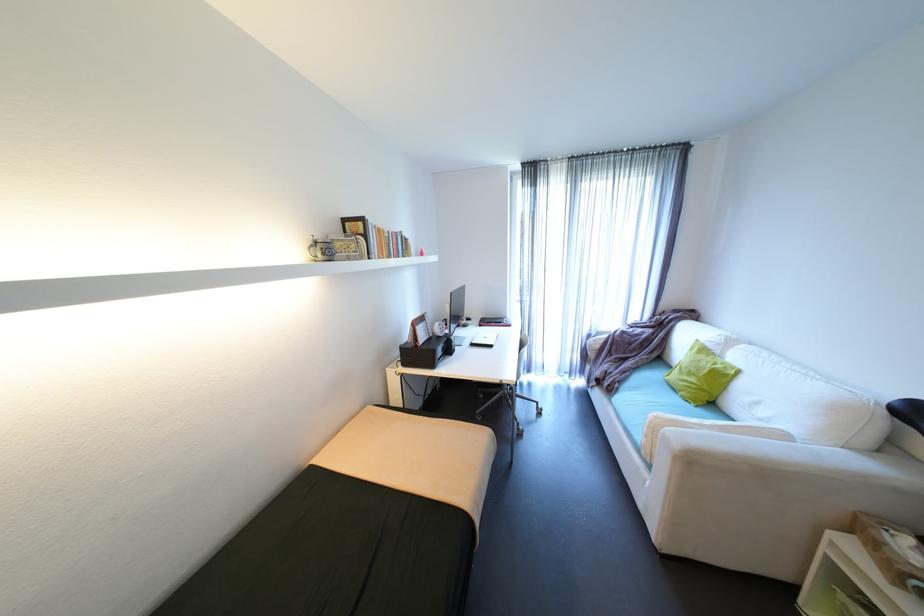
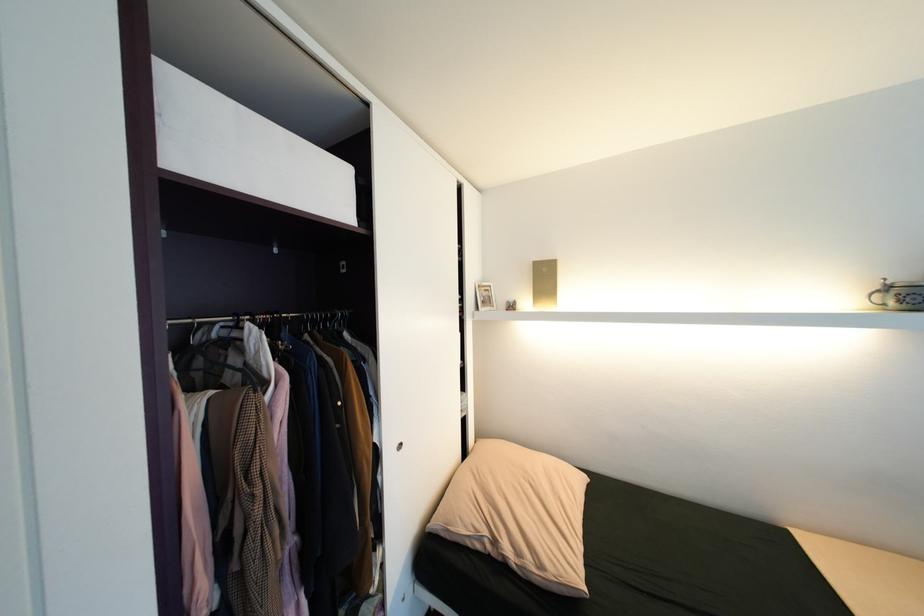
Question: The camera is either moving clockwise (left) or counter-clockwise (right) around the object. The first image is from the beginning of the video and the second image is from the end. Is the camera moving left or right when shooting the video?

Choices:
 (A) Left
 (B) Right

Answer: (B)